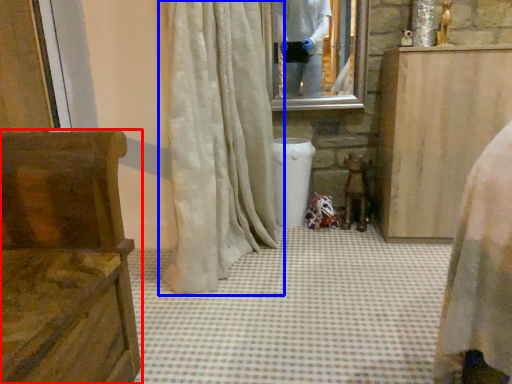
Question: Which object is further to the camera taking this photo, furniture (highlighted by a red box) or curtain (highlighted by a blue box)?

Choices:
 (A) furniture
 (B) curtain

Answer: (B)